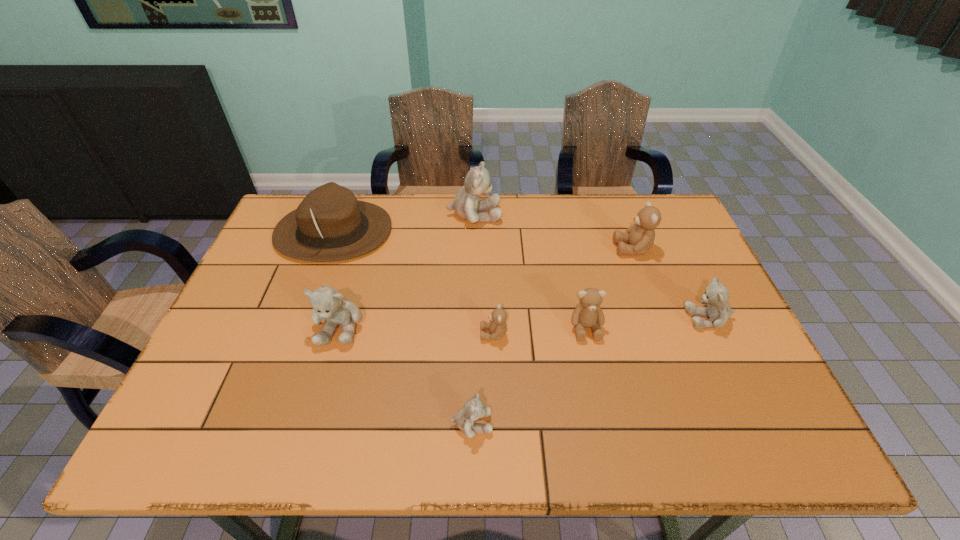
You are a GUI agent. You are given a task and a screenshot of the screen. Output one action in this format:
    pyautogui.click(x=<x>, y=<y>)
    Task: Click on the farthest teddy bear
    This screenshot has height=540, width=960.
    Given the screenshot: What is the action you would take?
    pyautogui.click(x=466, y=204)

Where is `the tallest teddy bear`? the tallest teddy bear is located at coordinates (466, 204).

Locate an element on the screen. This screenshot has width=960, height=540. fedora is located at coordinates (330, 224).

Identify the location of the second farthest teddy bear. (640, 236).

Locate an element on the screen. Image resolution: width=960 pixels, height=540 pixels. the second teddy bear from right to left is located at coordinates (640, 236).

The height and width of the screenshot is (540, 960). What are the coordinates of `the leftmost teddy bear` in the screenshot? It's located at (328, 304).

The image size is (960, 540). I want to click on the second biggest gray teddy bear, so click(328, 304).

You are a GUI agent. You are given a task and a screenshot of the screen. Output one action in this format:
    pyautogui.click(x=<x>, y=<y>)
    Task: Click on the third teddy bear from right to left
    This screenshot has width=960, height=540.
    Given the screenshot: What is the action you would take?
    pyautogui.click(x=588, y=314)

I want to click on the second brown teddy bear from right to left, so click(x=588, y=314).

Where is `the rightmost object`? The width and height of the screenshot is (960, 540). the rightmost object is located at coordinates (719, 311).